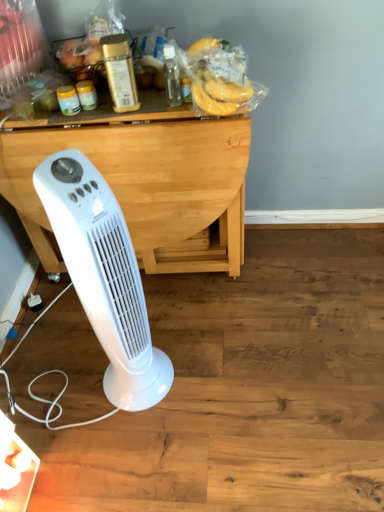
Where is `vacant area that lies between white plastic tower fan at lower left and wooden table at center`? The height and width of the screenshot is (512, 384). vacant area that lies between white plastic tower fan at lower left and wooden table at center is located at coordinates (149, 321).